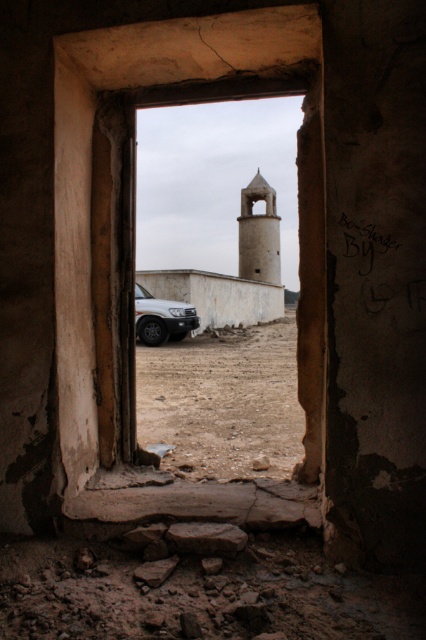
Is point (273, 417) more distant than point (160, 307)?

No, (273, 417) is closer to viewer.

What do you see at coordinates (224, 400) in the screenshot?
I see `brown sandy dirt at center` at bounding box center [224, 400].

Is point (261, 416) positioned in front of point (164, 321)?

Yes, it is in front of point (164, 321).

Locate an element on the screen. The width and height of the screenshot is (426, 640). brown sandy dirt at center is located at coordinates (224, 400).

Is smooth beige tower at center positioned before sandy beige metallic car at center?

No.

Does smooth beige tower at center appear on the left side of sandy beige metallic car at center?

Incorrect, smooth beige tower at center is not on the left side of sandy beige metallic car at center.

Which is behind, point (256, 280) or point (164, 316)?

The point (256, 280) is more distant.

At what (x,y) coordinates should I click in order to perform the action: click on smooth beige tower at center. Please return your answer as a coordinate pair (x, y). Looking at the image, I should click on (259, 234).

Is brown concrete window frame at center closer to the viewer compared to sandy beige metallic car at center?

Yes, it is.

Which of these two, brown concrete window frame at center or sandy beige metallic car at center, stands taller?

With more height is brown concrete window frame at center.

The height and width of the screenshot is (640, 426). I want to click on brown concrete window frame at center, so click(135, 202).

Image resolution: width=426 pixels, height=640 pixels. What are the coordinates of `brown concrete window frame at center` in the screenshot? It's located at (135, 202).